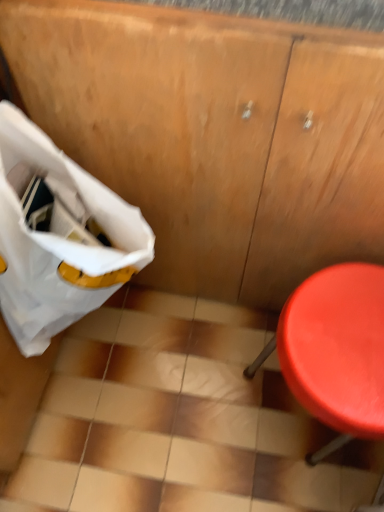
Find the location of a particular element. free spot above smooth plastic stool at right (from a real-world perspective) is located at coordinates (339, 339).